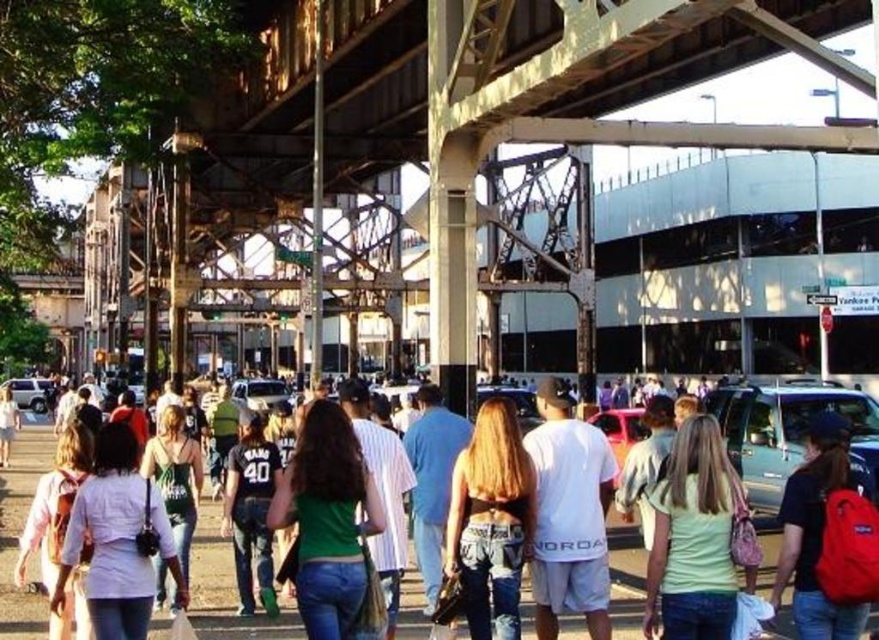
Does point (212, 564) come in front of point (267, 522)?

No, (212, 564) is behind (267, 522).

This screenshot has width=879, height=640. In order to click on denim jeans at center in this screenshot , I will do `click(226, 589)`.

Describe the element at coordinates (226, 589) in the screenshot. I see `denim jeans at center` at that location.

You are a GUI agent. You are given a task and a screenshot of the screen. Output one action in this format:
    pyautogui.click(x=<x>, y=<y>)
    Task: Click on the denim jeans at center
    This screenshot has height=640, width=879.
    Given the screenshot: What is the action you would take?
    pyautogui.click(x=226, y=589)

From the picture: Who is positioned more to the left, green matte shirt at center or denim shorts at center?

green matte shirt at center

Can you confirm if green matte shirt at center is shorter than denim shorts at center?

Yes.

Is point (295, 541) in front of point (500, 609)?

That is True.

The width and height of the screenshot is (879, 640). Find the location of `green matte shirt at center`. green matte shirt at center is located at coordinates (327, 520).

Can you confirm if light green t-shirt at center is positioned below green matte shirt at center?

Yes.

Which is below, light green t-shirt at center or green matte shirt at center?

light green t-shirt at center

Who is more forward, (647, 579) or (345, 432)?

Point (345, 432) is in front.

Where is `light green t-shirt at center`? This screenshot has height=640, width=879. light green t-shirt at center is located at coordinates (694, 536).